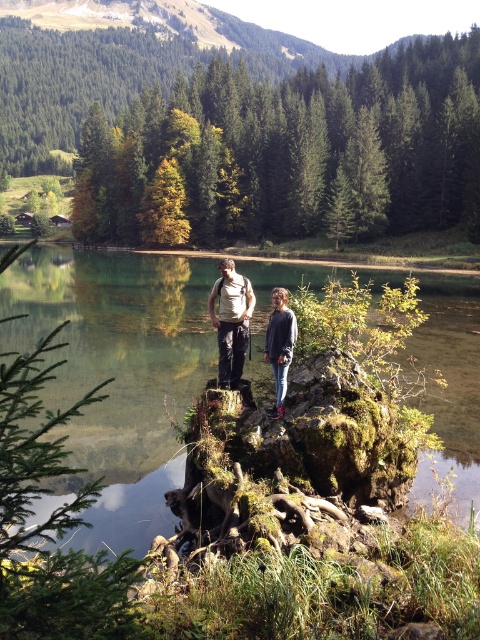
Question: Is green mossy rock at center bigger than gray sweater at center?

Choices:
 (A) yes
 (B) no

Answer: (A)

Question: Which object appears farthest from the camera in this image?

Choices:
 (A) green mossy rock at center
 (B) khaki fabric pants at center

Answer: (B)

Question: Does green mossy rock at center appear on the left side of khaki fabric pants at center?

Choices:
 (A) yes
 (B) no

Answer: (A)

Question: Which object is farther from the camera taking this photo?

Choices:
 (A) gray sweater at center
 (B) green mossy rock at center

Answer: (A)

Question: Among these points, which one is nearest to the camera?

Choices:
 (A) (235, 324)
 (B) (476, 340)
 (C) (276, 308)

Answer: (C)

Question: Is green mossy rock at center bigger than khaki fabric pants at center?

Choices:
 (A) no
 (B) yes

Answer: (B)